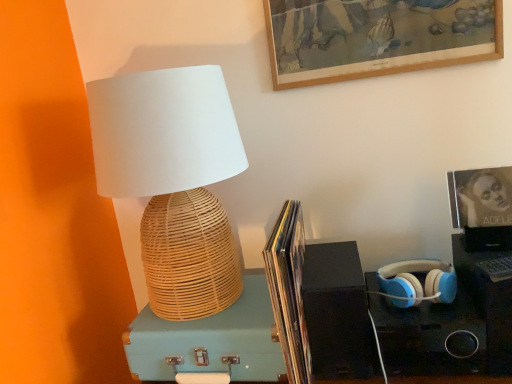
This screenshot has height=384, width=512. Identify the location of vacant area on top of black matte speaker at lower right (from a real-world perspective). (330, 253).